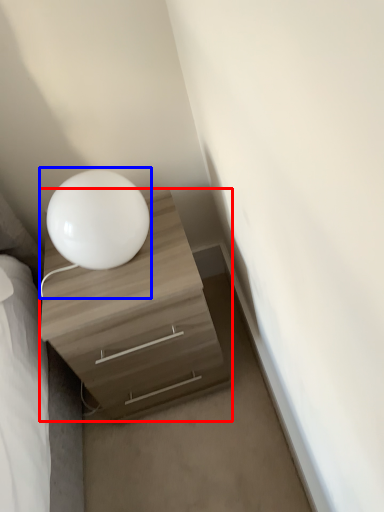
Question: Which of the following is the closest to the observer, chest of drawers (highlighted by a red box) or table lamp (highlighted by a blue box)?

Choices:
 (A) chest of drawers
 (B) table lamp

Answer: (B)